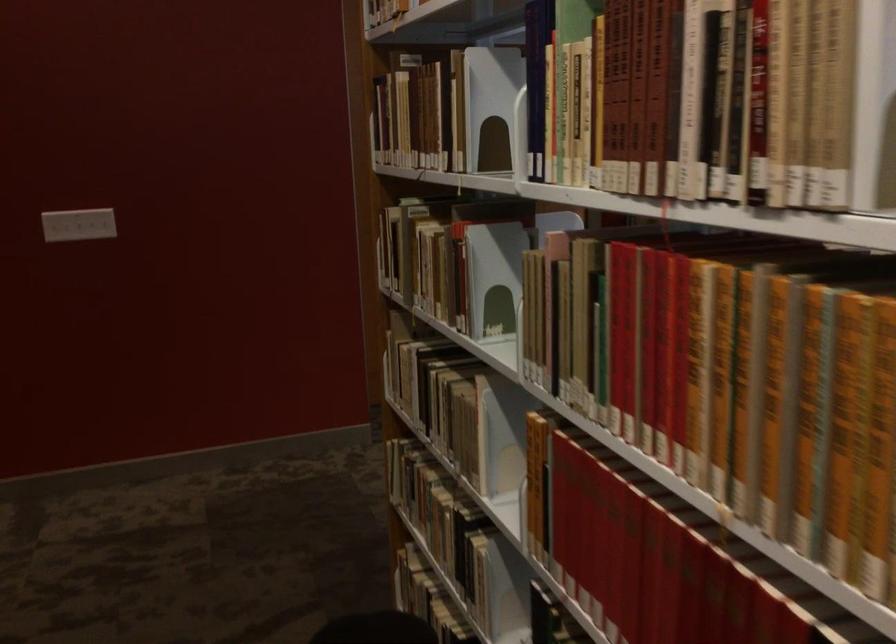
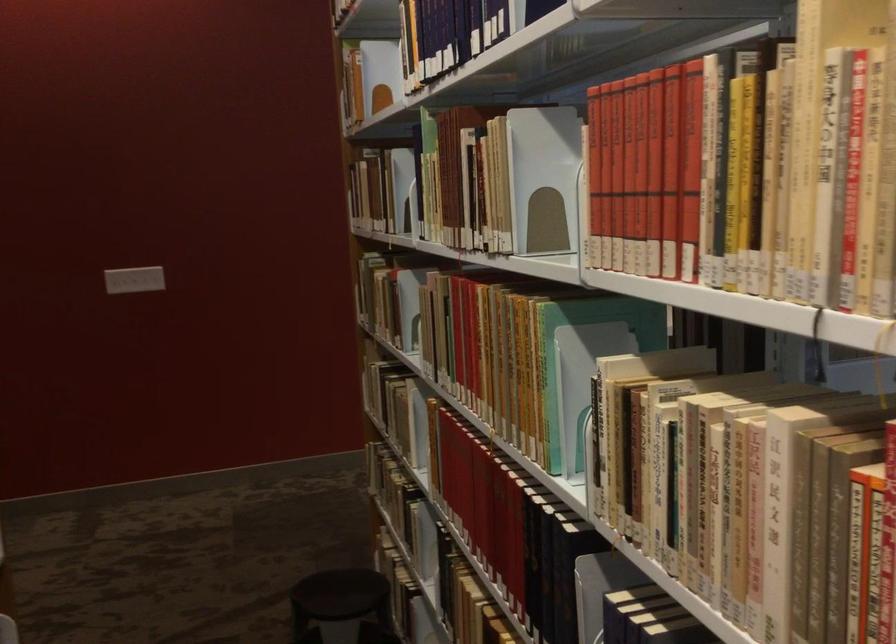
Locate, in the second image, the point that corresponds to (x=477, y=115) in the first image.

(400, 190)